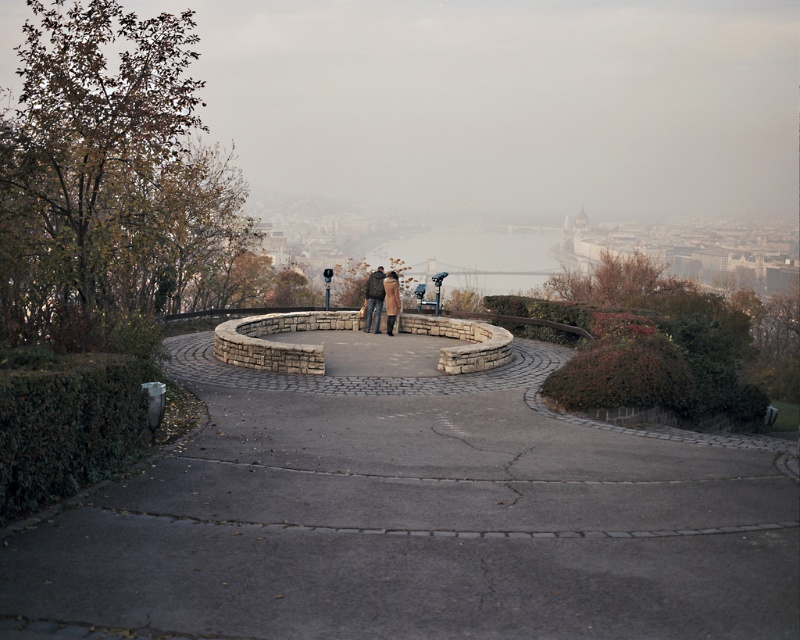
You are standing on the viewing platform and want to greet the person wearing the brown wool coat at center. Which direction should you walk from the brown leather coat at center to reach them?

You should walk away from the brown leather coat at center towards the brown wool coat at center since the brown leather coat at center is closer to you than the brown wool coat at center.

You are standing on the viewing platform and want to walk to the gray concrete path at center. There is a brown leather coat at center in your way. Which direction should you move to avoid stepping on the coat?

The gray concrete path at center is to the right of the brown leather coat at center, so you should move to the right to avoid stepping on the coat.